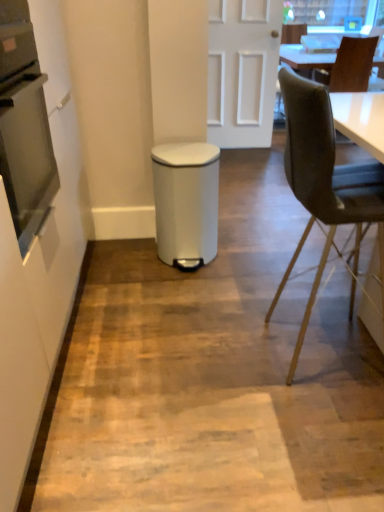
At what (x,y) coordinates should I click in order to perform the action: click on free space to the back side of velvet black chair at right, positioned as the first chair in bottom-to-top order. Please return your answer as a coordinate pair (x, y). Looking at the image, I should click on (284, 291).